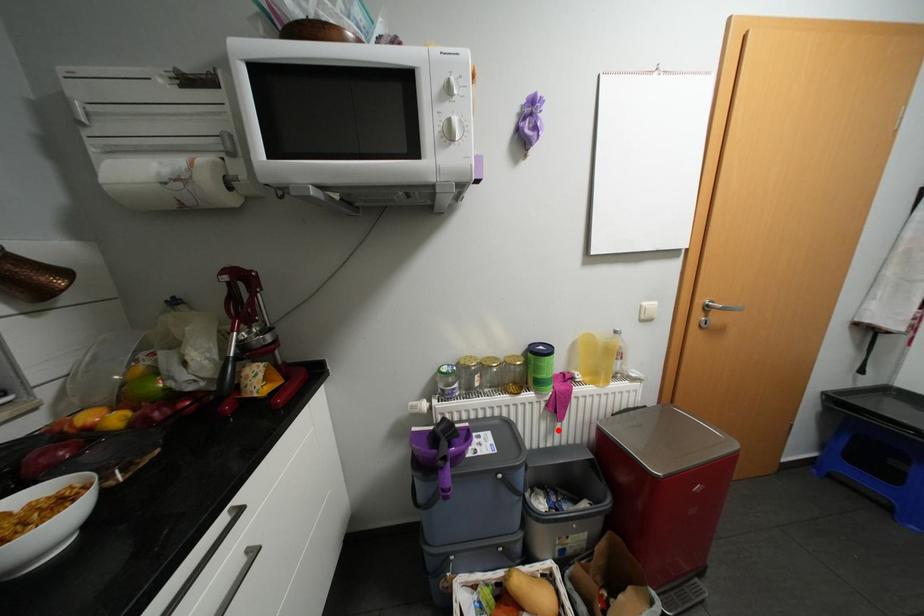
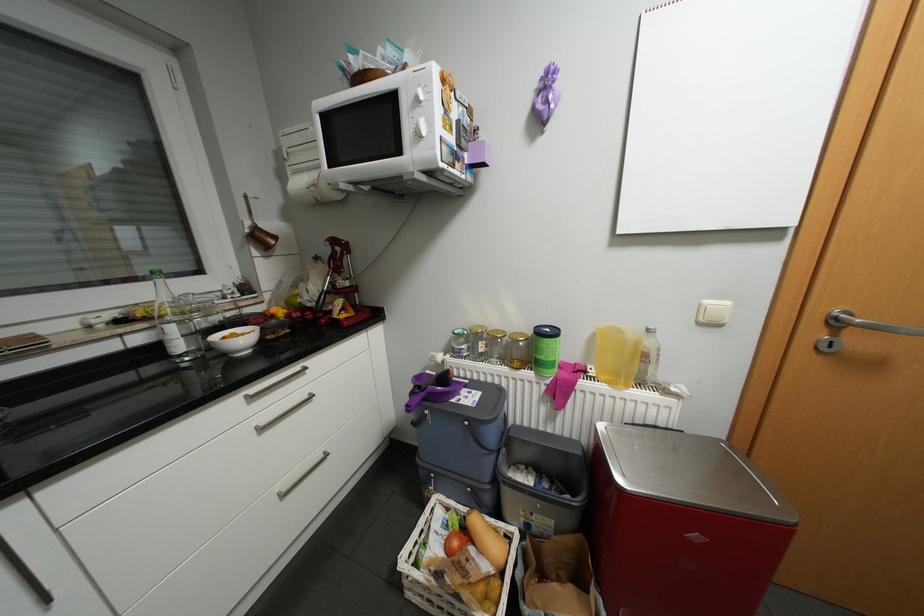
Locate, in the second image, the point that corresponds to the highlighted location in the first image.

(558, 416)